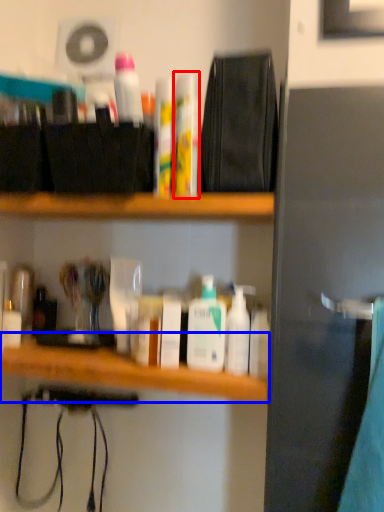
Question: Among these objects, which one is nearest to the camera, toiletry (highlighted by a red box) or counter (highlighted by a blue box)?

Choices:
 (A) toiletry
 (B) counter

Answer: (B)